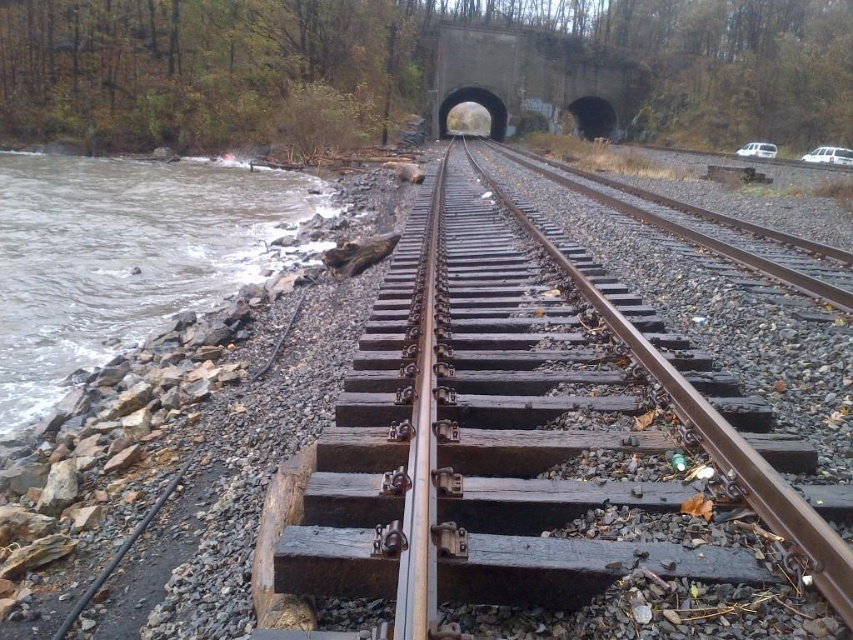
Question: Does gray rocky river at left have a greater width compared to concrete/tunnel at center?

Choices:
 (A) yes
 (B) no

Answer: (B)

Question: Which point appears farthest from the camera in this image?

Choices:
 (A) (260, 577)
 (B) (16, 189)

Answer: (B)

Question: Is gray rocky river at left to the right of concrete/tunnel at center from the viewer's perspective?

Choices:
 (A) yes
 (B) no

Answer: (B)

Question: Can you confirm if rusty metal track at center is smaller than gray rocky river at left?

Choices:
 (A) no
 (B) yes

Answer: (B)

Question: Considering the real-world distances, which object is closest to the concrete/tunnel at center?

Choices:
 (A) rusty metal track at center
 (B) gray rocky river at left

Answer: (B)

Question: Among these points, which one is farthest from the camera?

Choices:
 (A) (352, 435)
 (B) (482, 60)
 (C) (312, 188)

Answer: (B)